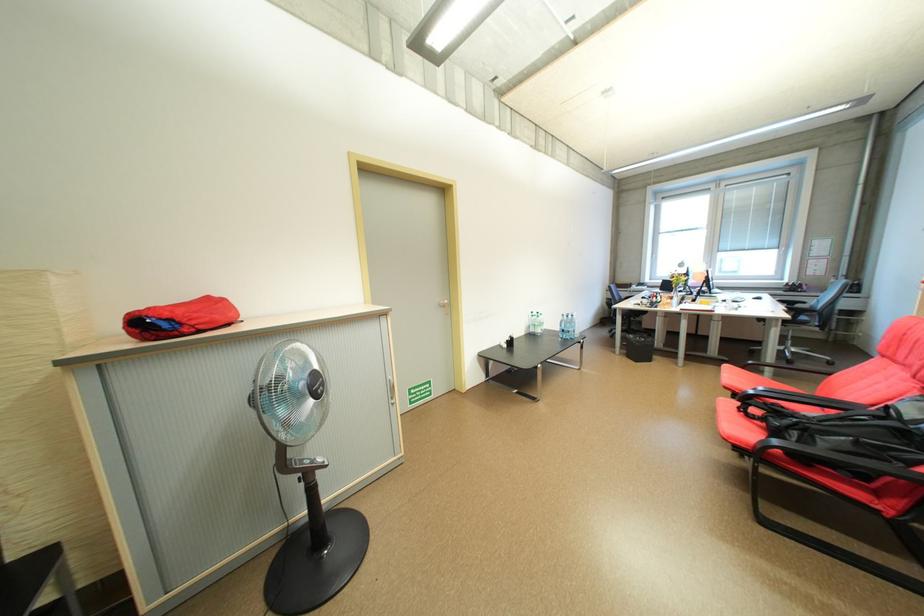
The image size is (924, 616). What are the coordinates of `cabinet handle` in the screenshot? It's located at (391, 387).